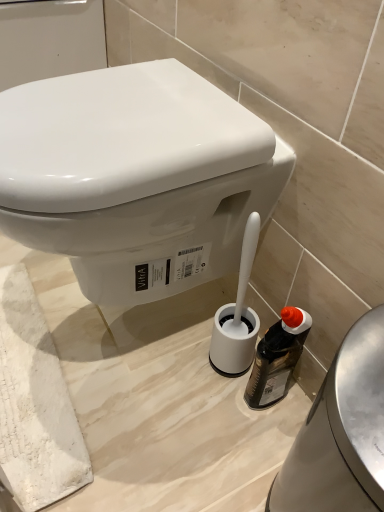
Question: Would you say white glossy toilet at center is a long distance from translucent plastic bottle at lower right?

Choices:
 (A) no
 (B) yes

Answer: (A)

Question: From a real-world perspective, is white glossy toilet at center on top of translucent plastic bottle at lower right?

Choices:
 (A) yes
 (B) no

Answer: (A)

Question: Is white glossy toilet at center to the right of translucent plastic bottle at lower right from the viewer's perspective?

Choices:
 (A) yes
 (B) no

Answer: (B)

Question: Is white glossy toilet at center looking in the opposite direction of translucent plastic bottle at lower right?

Choices:
 (A) yes
 (B) no

Answer: (B)

Question: From the image's perspective, does white glossy toilet at center appear lower than translucent plastic bottle at lower right?

Choices:
 (A) no
 (B) yes

Answer: (A)

Question: Is white plastic toilet brush holder at lower center inside the boundaries of translucent plastic bottle at lower right, or outside?

Choices:
 (A) outside
 (B) inside

Answer: (A)

Question: Looking at the image, does white plastic toilet brush holder at lower center seem bigger or smaller compared to translucent plastic bottle at lower right?

Choices:
 (A) big
 (B) small

Answer: (A)

Question: Is white plastic toilet brush holder at lower center to the left or to the right of translucent plastic bottle at lower right in the image?

Choices:
 (A) right
 (B) left

Answer: (A)

Question: From the image's perspective, is white plastic toilet brush holder at lower center above or below translucent plastic bottle at lower right?

Choices:
 (A) below
 (B) above

Answer: (A)

Question: Is point (289, 478) positioned closer to the camera than point (233, 162)?

Choices:
 (A) closer
 (B) farther

Answer: (B)

Question: Would you say white plastic toilet brush holder at lower center is to the left or to the right of white glossy toilet at center in the picture?

Choices:
 (A) right
 (B) left

Answer: (A)

Question: Considering their positions, is white plastic toilet brush holder at lower center located in front of or behind white glossy toilet at center?

Choices:
 (A) front
 (B) behind

Answer: (A)

Question: Is white plastic toilet brush holder at lower center taller or shorter than white glossy toilet at center?

Choices:
 (A) tall
 (B) short

Answer: (A)

Question: Looking at the image, does white glossy toilet at center seem bigger or smaller compared to white plastic toilet brush holder at lower center?

Choices:
 (A) big
 (B) small

Answer: (A)

Question: From a real-world perspective, is white glossy toilet at center above or below white plastic toilet brush holder at lower center?

Choices:
 (A) below
 (B) above

Answer: (B)